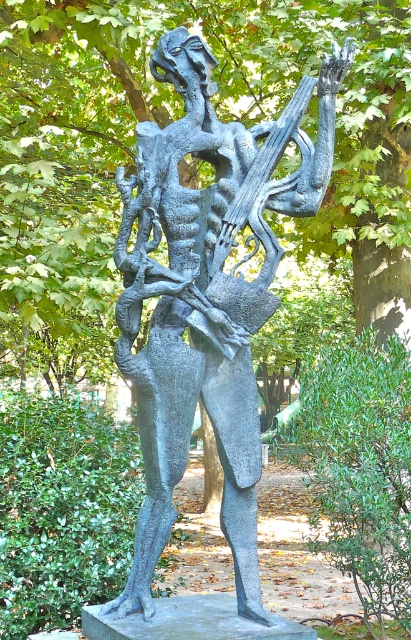
Question: Observing the image, what is the correct spatial positioning of green leafy tree at upper center in reference to bronze textured sculpture at center?

Choices:
 (A) below
 (B) above

Answer: (B)

Question: Among these objects, which one is farthest from the camera?

Choices:
 (A) bronze textured sculpture at center
 (B) green leafy tree at upper center

Answer: (B)

Question: Does green leafy tree at upper center appear on the left side of bronze textured sculpture at center?

Choices:
 (A) yes
 (B) no

Answer: (B)

Question: Is green leafy tree at upper center to the right of bronze textured sculpture at center from the viewer's perspective?

Choices:
 (A) yes
 (B) no

Answer: (A)

Question: Among these objects, which one is nearest to the camera?

Choices:
 (A) bronze textured sculpture at center
 (B) green leafy tree at upper center

Answer: (A)